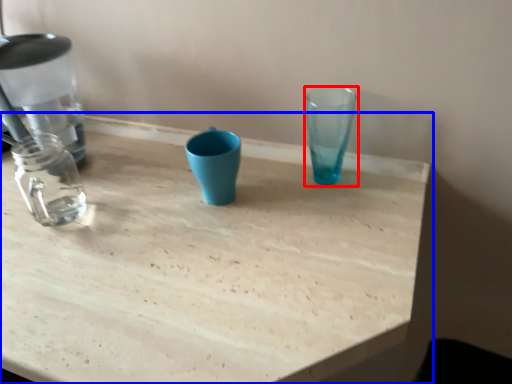
Question: Among these objects, which one is nearest to the camera, vase (highlighted by a red box) or table (highlighted by a blue box)?

Choices:
 (A) vase
 (B) table

Answer: (B)